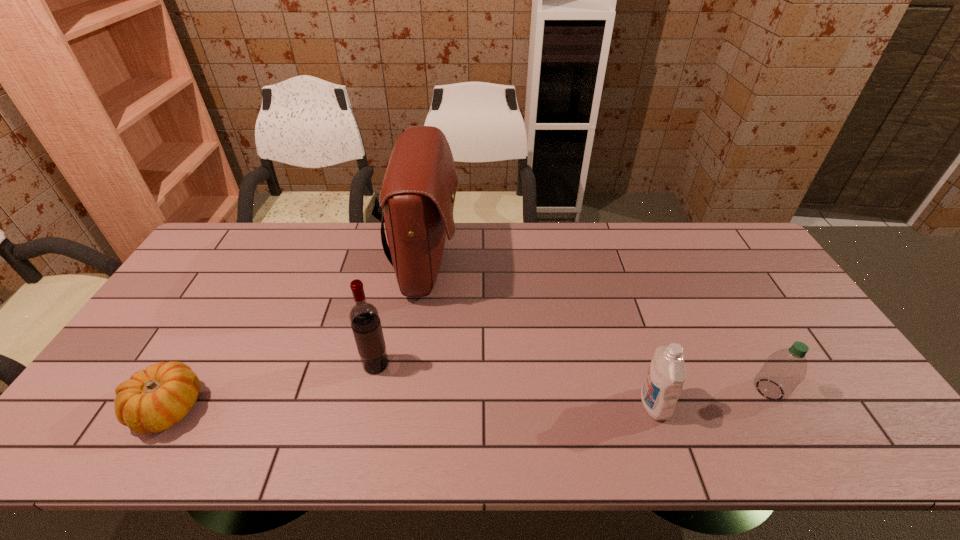
Where is `free space between the satchel and the water bottle`? Image resolution: width=960 pixels, height=540 pixels. free space between the satchel and the water bottle is located at coordinates (598, 327).

Locate an element on the screen. blank region between the second tallest object and the fourth object from left to right is located at coordinates [516, 384].

What are the coordinates of `vacant region between the satchel and the gourd` in the screenshot? It's located at (298, 336).

Find the location of a particular element. vacant area between the leftmost object and the water bottle is located at coordinates (468, 399).

Point out which object is positioned as the nearest to the farthest object. Please provide its 2D coordinates. Your answer should be formatted as a tuple, i.e. [(x, y)], where the tuple contains the x and y coordinates of a point satisfying the conditions above.

[(364, 318)]

This screenshot has width=960, height=540. Find the location of `object that is the closest to the detergent`. object that is the closest to the detergent is located at coordinates (783, 370).

This screenshot has height=540, width=960. Find the location of `vacant point that satisfies the following two spatial constraints: 1. on the open flap of the satchel; 2. on the right side of the detergent`. vacant point that satisfies the following two spatial constraints: 1. on the open flap of the satchel; 2. on the right side of the detergent is located at coordinates (408, 404).

You are a GUI agent. You are given a task and a screenshot of the screen. Output one action in this format:
    pyautogui.click(x=<x>, y=<y>)
    Task: Click on the free space that satisfies the following two spatial constraints: 1. on the back side of the fourth object from left to right; 2. on the right side of the rightmost object
    The image size is (960, 540).
    Given the screenshot: What is the action you would take?
    pyautogui.click(x=650, y=389)

You are a GUI agent. You are given a task and a screenshot of the screen. Output one action in this format:
    pyautogui.click(x=<x>, y=<y>)
    Task: Click on the vacant area that satisfies the following two spatial constraints: 1. on the back side of the detergent; 2. on the open flap of the satchel
    
    Given the screenshot: What is the action you would take?
    pyautogui.click(x=608, y=264)